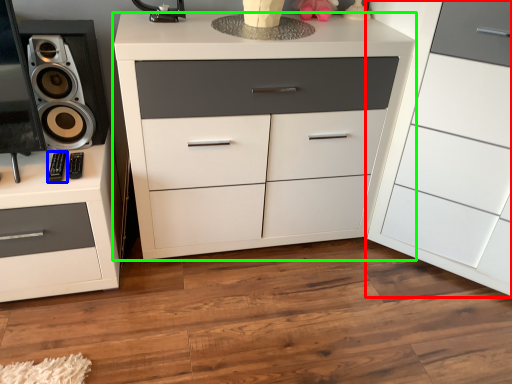
Question: Considering the real-world distances, which object is closest to chest of drawers (highlighted by a red box)? control (highlighted by a blue box) or chest of drawers (highlighted by a green box).

Choices:
 (A) control
 (B) chest of drawers

Answer: (B)